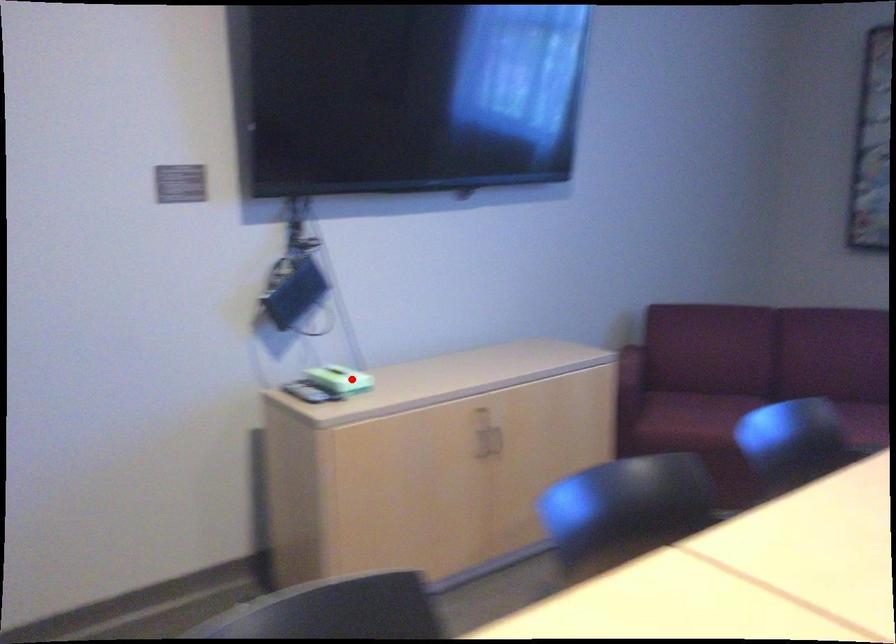
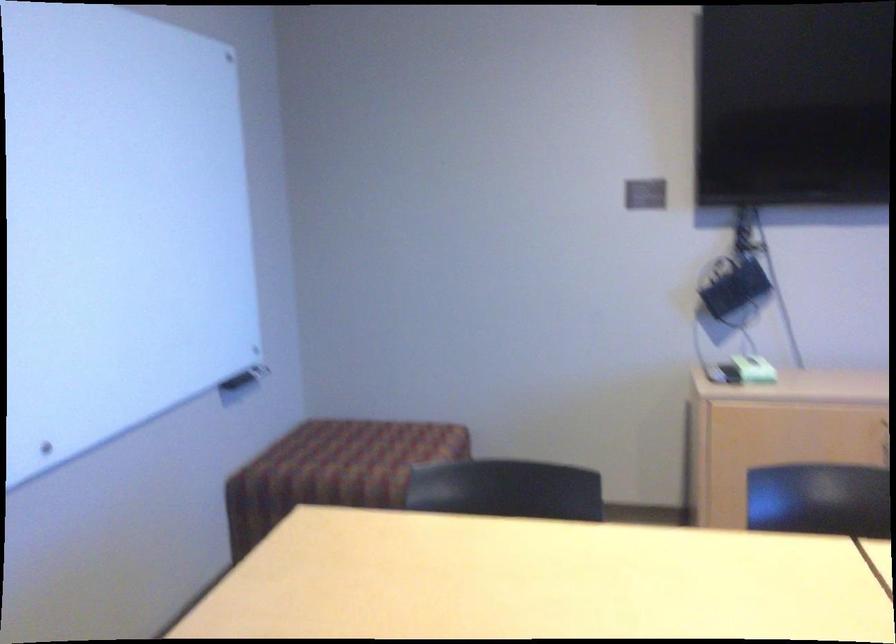
Question: I am providing you with two images of the same scene from different viewpoints. A red point is shown in image1. For the corresponding object point in image2, is it positioned nearer or farther from the camera?

Choices:
 (A) Nearer
 (B) Farther

Answer: (B)